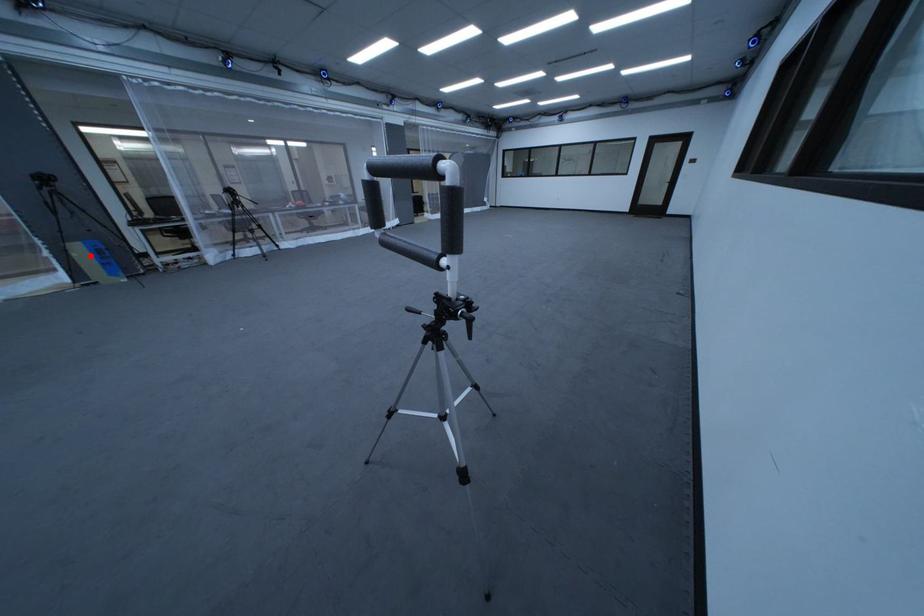
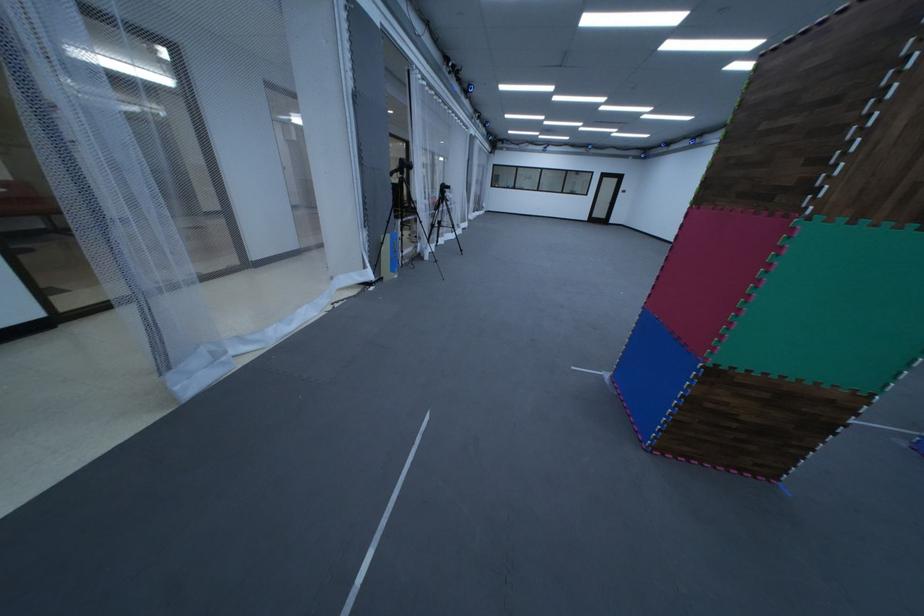
Question: I am providing you with two images of the same scene from different viewpoints. Given a red point in image1, look at the same physical point in image2. Is it:

Choices:
 (A) Closer to the viewpoint
 (B) Farther from the viewpoint

Answer: (A)